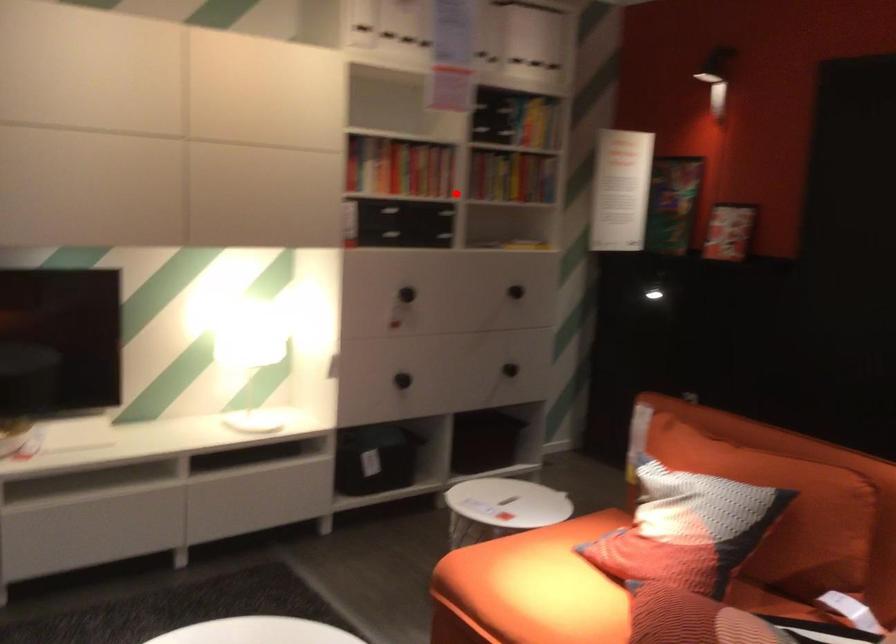
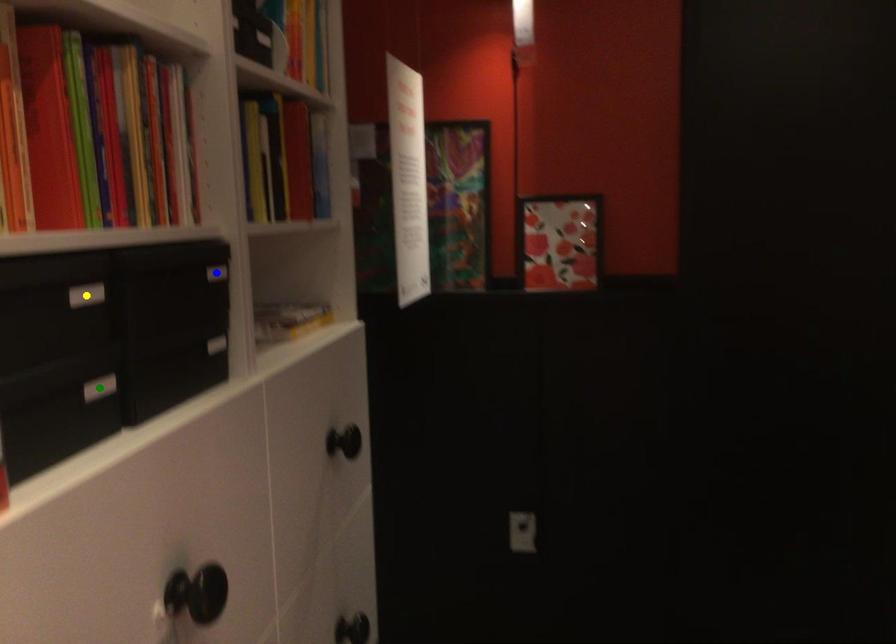
Question: I am providing you with two images of the same scene from different viewpoints. A red point is marked on the first image. You are given multiple points on the second image. Which mark in image 2 goes with the point in image 1?

Choices:
 (A) yellow point
 (B) blue point
 (C) green point

Answer: (B)